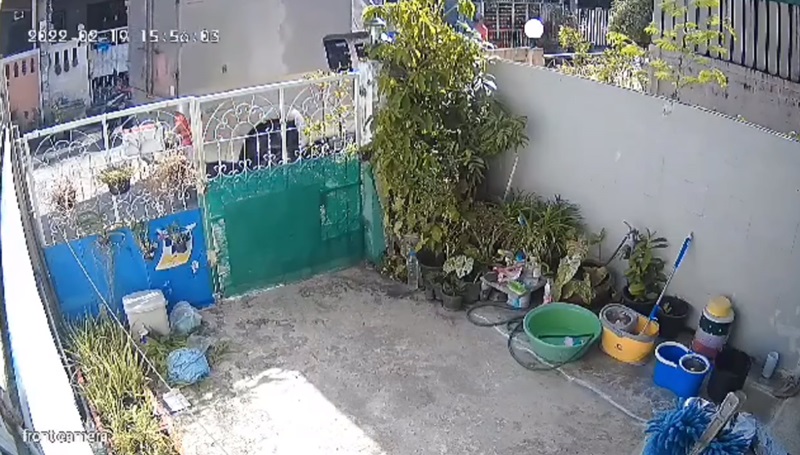
I want to click on concrete wall, so click(x=766, y=175).